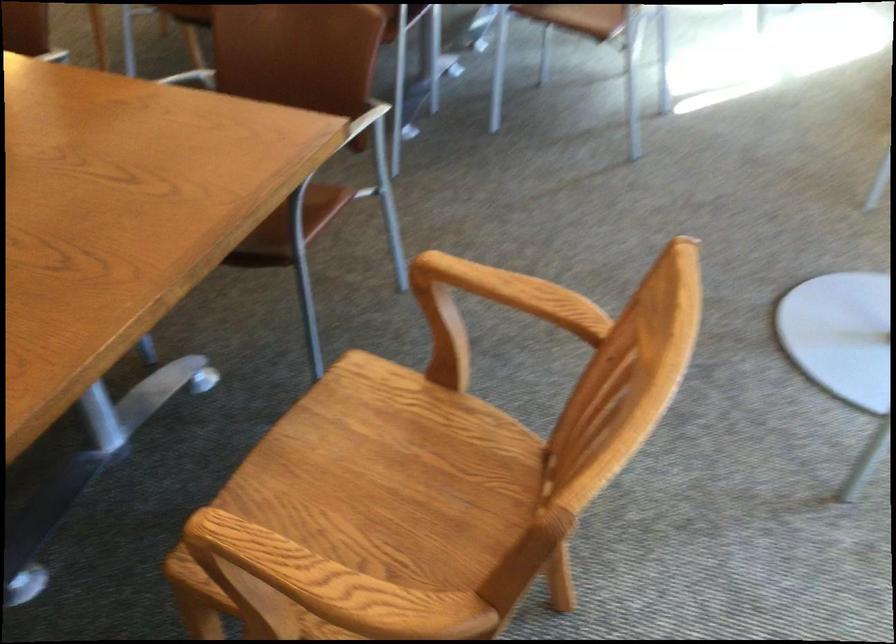
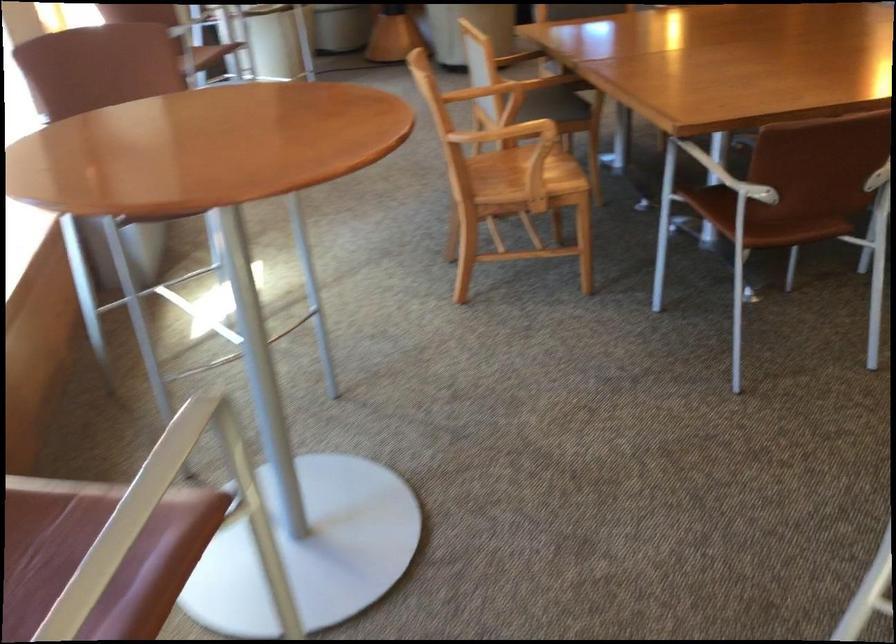
Where in the second image is the point corresponding to point 134,149 from the first image?

(728, 176)